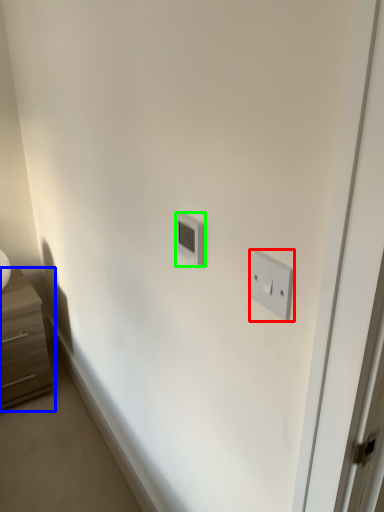
Question: Which object is the farthest from light switch (highlighted by a red box)? Choose among these: chest of drawers (highlighted by a blue box) or light switch (highlighted by a green box).

Choices:
 (A) chest of drawers
 (B) light switch

Answer: (A)